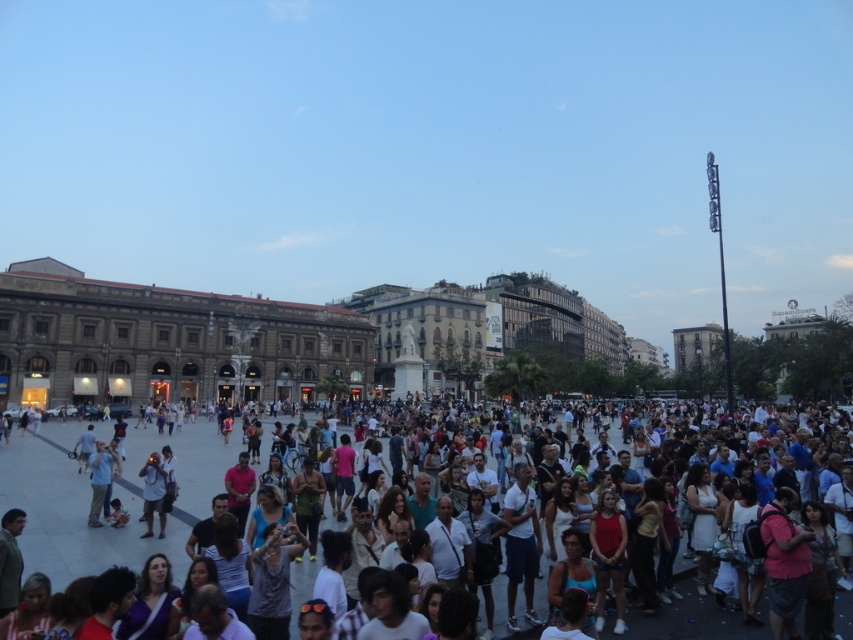
Does white cotton shirt at center have a greater height compared to light blue cotton shirt at lower left?

Indeed, white cotton shirt at center has a greater height compared to light blue cotton shirt at lower left.

Between point (44, 563) and point (94, 445), which one is positioned in front?

Point (44, 563) is more forward.

This screenshot has height=640, width=853. What do you see at coordinates (90, 497) in the screenshot?
I see `white cotton shirt at center` at bounding box center [90, 497].

Find the location of `white cotton shirt at center`. white cotton shirt at center is located at coordinates (90, 497).